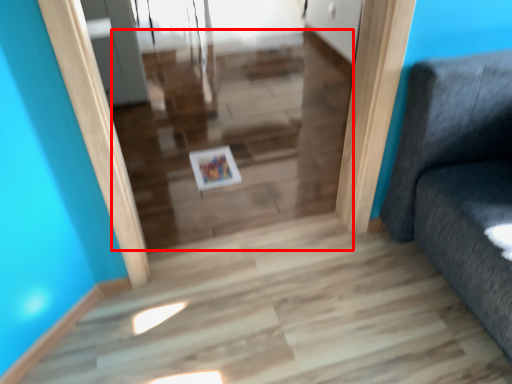
Question: From the image's perspective, what is the correct spatial relationship of stairwell (annotated by the red box) in relation to picture frame?

Choices:
 (A) above
 (B) below

Answer: (A)